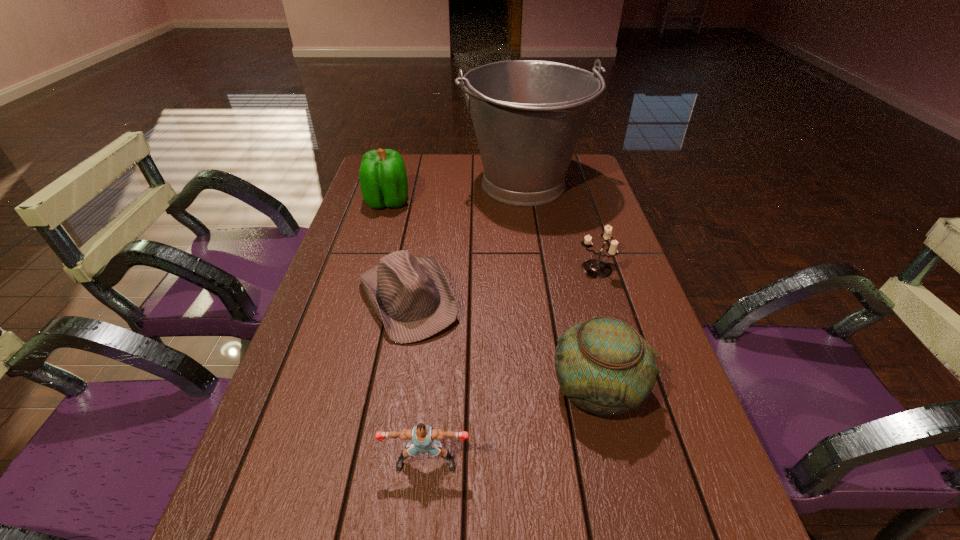
Where is `free space at the far edge of the desktop`? free space at the far edge of the desktop is located at coordinates (438, 163).

Where is `vacant region at the left edge of the desktop`? The height and width of the screenshot is (540, 960). vacant region at the left edge of the desktop is located at coordinates (349, 364).

This screenshot has height=540, width=960. Find the location of `free spot at the right edge of the desktop`. free spot at the right edge of the desktop is located at coordinates (575, 223).

Identify the location of free spot between the candle holder and the bell pepper. The width and height of the screenshot is (960, 540). (491, 235).

Find the location of `vacant space that is in between the fedora and the third tallest object`. vacant space that is in between the fedora and the third tallest object is located at coordinates (503, 343).

Find the location of a particular element. This screenshot has width=960, height=540. vacant region between the bucket and the nearest object is located at coordinates (475, 323).

The image size is (960, 540). Find the location of `empty space that is in between the puncher and the fourth shortest object`. empty space that is in between the puncher and the fourth shortest object is located at coordinates (513, 426).

Where is `free point between the fourth shortest object and the fedora`? The height and width of the screenshot is (540, 960). free point between the fourth shortest object and the fedora is located at coordinates (503, 343).

Find the location of a particular element. Image resolution: width=960 pixels, height=540 pixels. empty space that is in between the candle holder and the fedora is located at coordinates (501, 284).

Identify the location of unoccupied position between the bell pepper and the pottery. (492, 295).